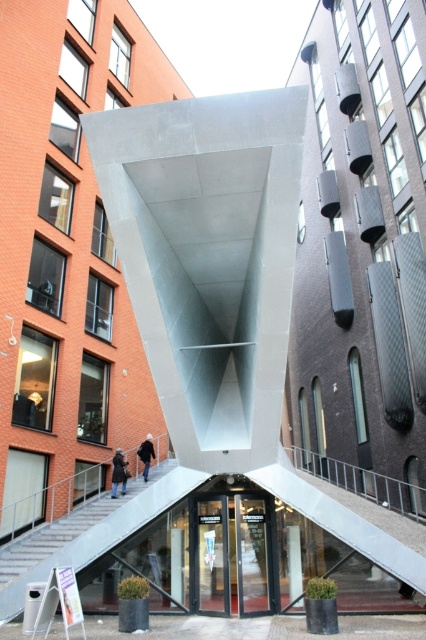
You are standing in front of the modern metallic sculpture and want to enter through the transparent glass door at center. Is the black matte jacket at lower left blocking your path to the door?

The transparent glass door at center is in front of the black matte jacket at lower left, so the jacket is behind the door and not blocking your path to the door.

You are a delivery person approaching the transparent glass door at center and the dark gray coat at lower left. Which object would you encounter first as you walk towards them?

You would encounter the transparent glass door at center first because it is positioned in front of the dark gray coat at lower left, making it closer to your path.